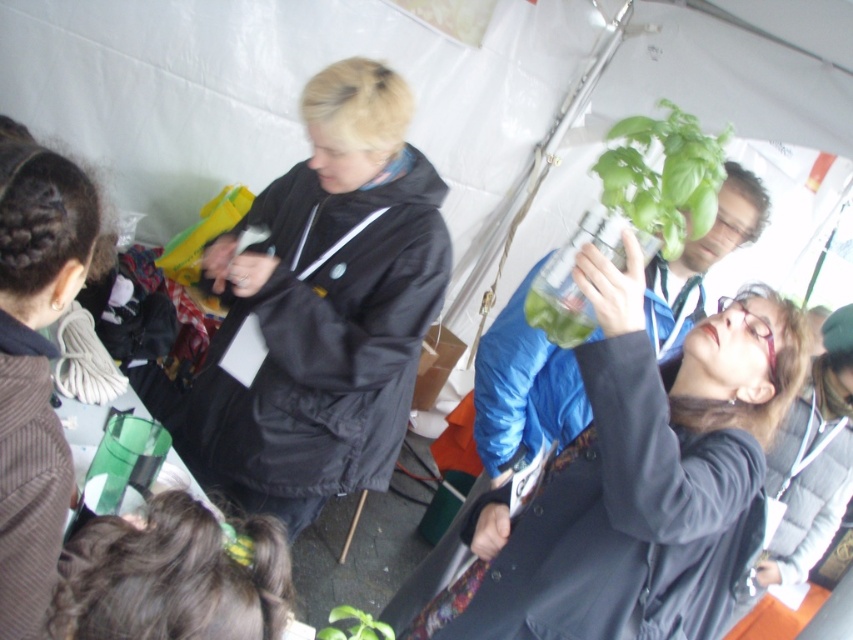
Question: Considering the relative positions of black matte jacket at center and dark brown hair at lower left in the image provided, where is black matte jacket at center located with respect to dark brown hair at lower left?

Choices:
 (A) above
 (B) below

Answer: (A)

Question: Can you confirm if matte black coat at center is wider than dark brown hair at lower left?

Choices:
 (A) no
 (B) yes

Answer: (B)

Question: Estimate the real-world distances between objects in this image. Which object is closer to the dark brown hair at lower left?

Choices:
 (A) black matte jacket at center
 (B) matte black coat at center
 (C) dark brown textured sweater at lower left

Answer: (C)

Question: Can you confirm if black matte jacket at center is smaller than dark brown textured sweater at lower left?

Choices:
 (A) yes
 (B) no

Answer: (B)

Question: Which point is closer to the camera?

Choices:
 (A) (9, 196)
 (B) (604, 385)
 (C) (357, 216)

Answer: (A)

Question: Which point is farther to the camera?

Choices:
 (A) dark brown hair at lower left
 (B) dark brown textured sweater at lower left

Answer: (B)